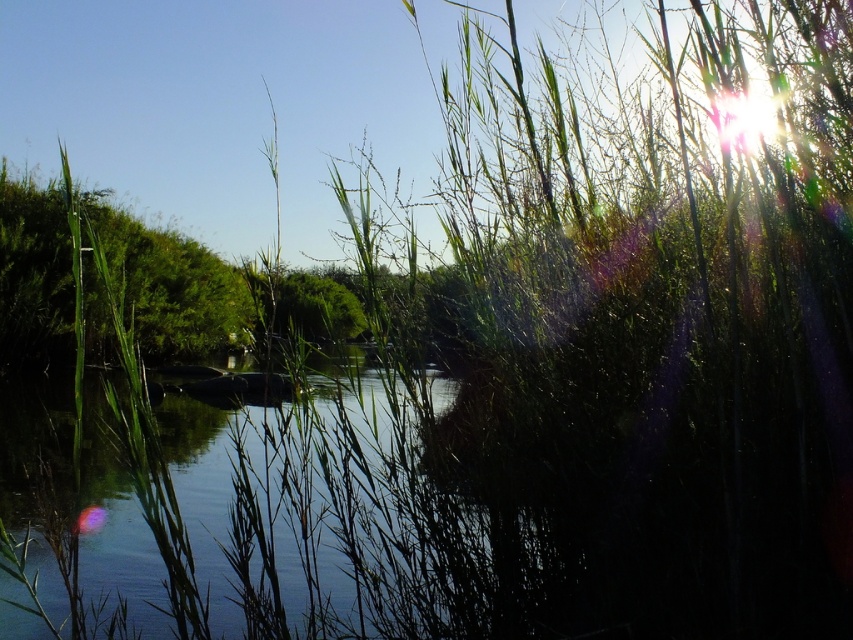
You are standing at the edge of the scene and want to locate the clear water at center. According to the coordinates provided, in which direction should you look to find it?

The clear water at center is located at coordinates point (276, 529), so you should look to the right and slightly upward from your current position to find it.

You are standing at the edge of the water body in the serene natural scene. You notice two points marked in the image. Which point, point 1 at coordinates (86, 573) or point 2 at coordinates (7, 269), is closer to your current position?

Point 1 at coordinates (86, 573) is closer to the camera than point 2 at coordinates (7, 269), so it is closer to your current position.

You are standing in the serene natural scene and want to walk from the green leafy bush at left to the clear water at center. Which direction should you head?

You should head to the right to reach the clear water at center from the green leafy bush at left since the clear water at center is to the right of the green leafy bush at left.